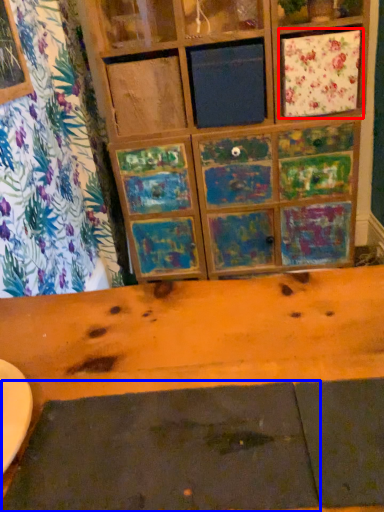
Question: Which point is closer to the camera, cabinetry (highlighted by a red box) or plank (highlighted by a blue box)?

Choices:
 (A) cabinetry
 (B) plank

Answer: (B)